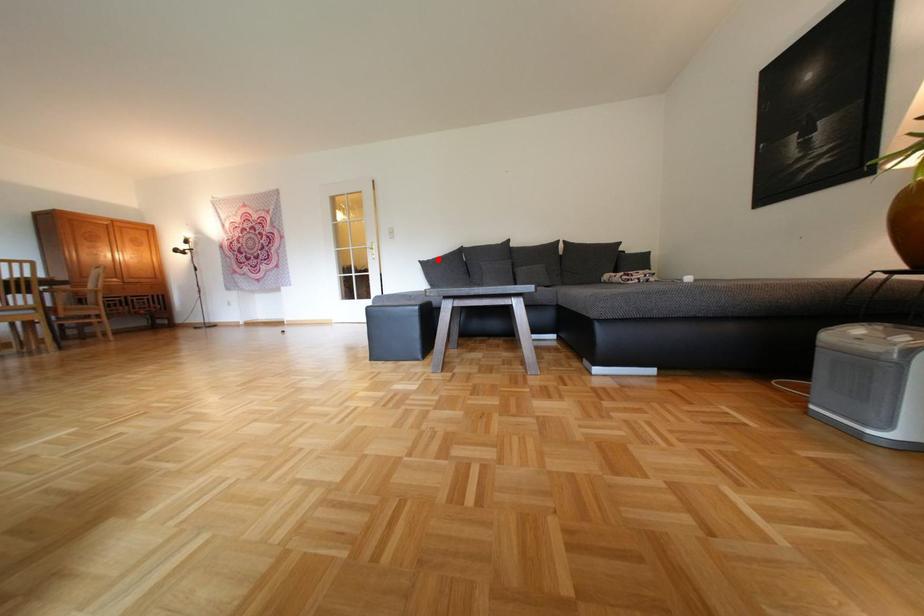
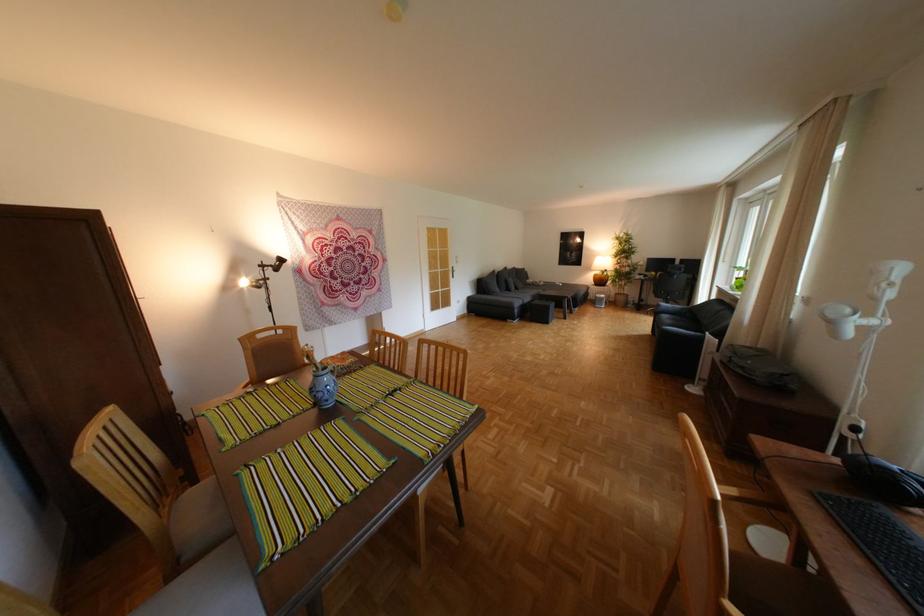
Question: A red point is marked in image1. In image2, is the corresponding 3D point closer to the camera or farther? Reply with the corresponding letter.

Choices:
 (A) The corresponding 3D point is closer.
 (B) The corresponding 3D point is farther.

Answer: (A)